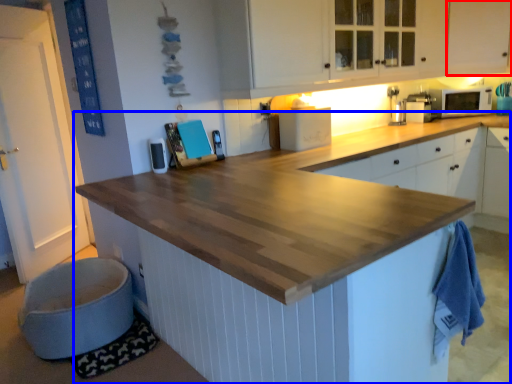
Question: Which point is further to the camera, cabinetry (highlighted by a red box) or countertop (highlighted by a blue box)?

Choices:
 (A) cabinetry
 (B) countertop

Answer: (A)